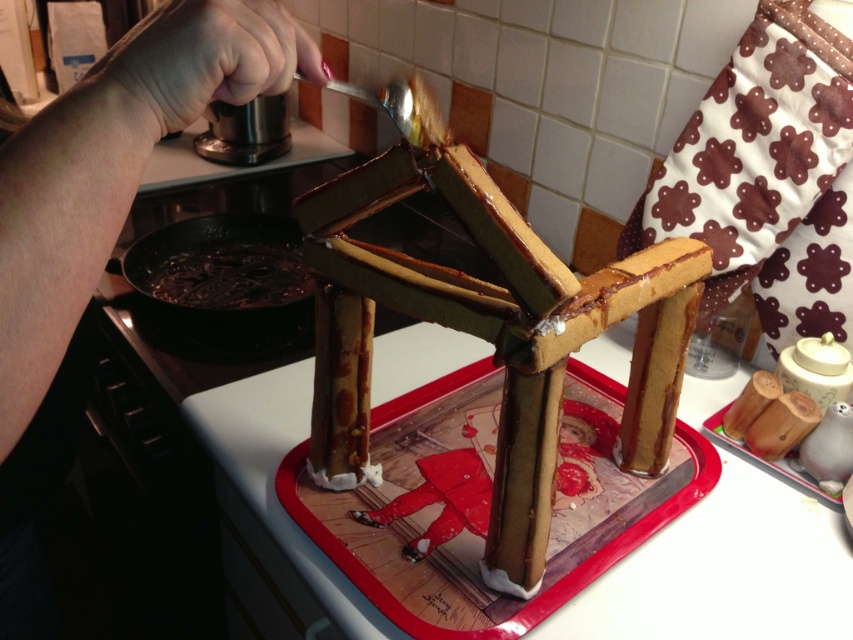
You are a chef preparing a gingerbread house. You have the smooth chocolate gingerbread house at center and the shiny dark chocolate at lower left. Which object is shorter?

The smooth chocolate gingerbread house at center is shorter than the shiny dark chocolate at lower left.

You are a baker who needs to place a new decoration on the smooth chocolate gingerbread house at center without accidentally touching the shiny dark chocolate at lower left. Which object should you move closer to you first?

The smooth chocolate gingerbread house at center is in front of the shiny dark chocolate at lower left, so you should move the smooth chocolate gingerbread house at center closer to you first to avoid the shiny dark chocolate at lower left.

You are trying to decide where to place a small candle on the countertop. The candle is exactly the same width as the shiny dark chocolate at lower left. If you want to place the candle next to the smooth chocolate gingerbread house at center, will it fit without overlapping?

The smooth chocolate gingerbread house at center might be wider than shiny dark chocolate at lower left. Since the candle has the same width as the shiny dark chocolate at lower left, it might fit next to the smooth chocolate gingerbread house at center, but there is uncertainty because the gingerbread house could be wider.